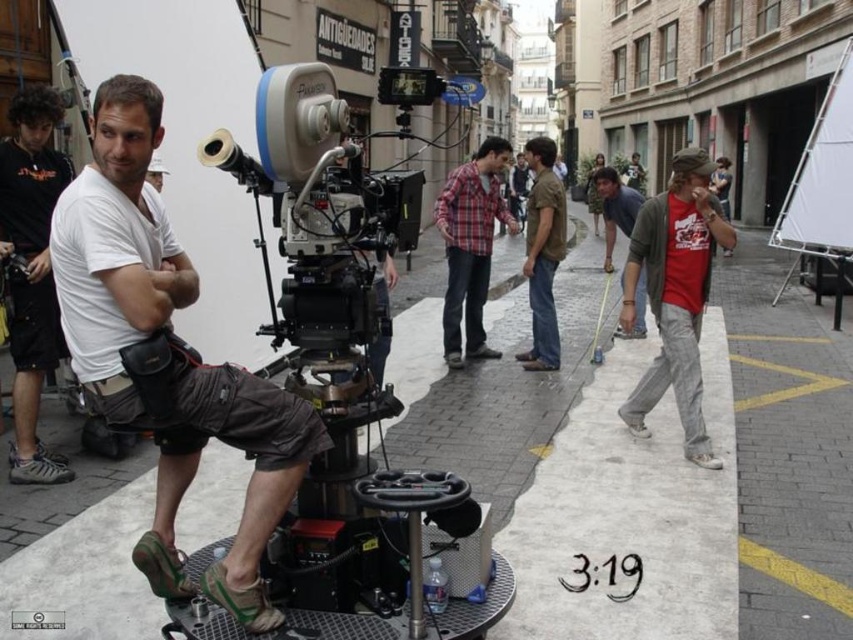
Question: Is plaid fabric shirt at center in front of brown cotton shirt at center?

Choices:
 (A) no
 (B) yes

Answer: (A)

Question: Does black fabric camera at left appear under brown cotton shirt at center?

Choices:
 (A) yes
 (B) no

Answer: (A)

Question: Which point appears farthest from the camera in this image?

Choices:
 (A) (283, 236)
 (B) (608, 173)
 (C) (439, 211)

Answer: (B)

Question: Does red cotton t-shirt at right have a larger size compared to brown cotton shirt at center?

Choices:
 (A) yes
 (B) no

Answer: (B)

Question: Which object appears closest to the camera in this image?

Choices:
 (A) red cotton shirt at right
 (B) red cotton t-shirt at right
 (C) silver metallic video camera at center
 (D) brown cotton shirt at center

Answer: (C)

Question: Among these objects, which one is farthest from the camera?

Choices:
 (A) brown cotton shirt at center
 (B) silver metallic video camera at center
 (C) black fabric camera at left

Answer: (A)